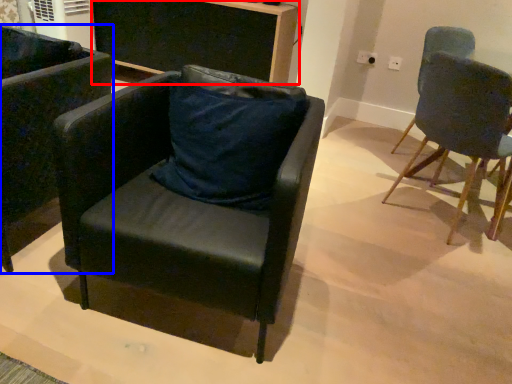
Question: Which object appears farthest to the camera in this image, desk (highlighted by a red box) or chair (highlighted by a blue box)?

Choices:
 (A) desk
 (B) chair

Answer: (A)